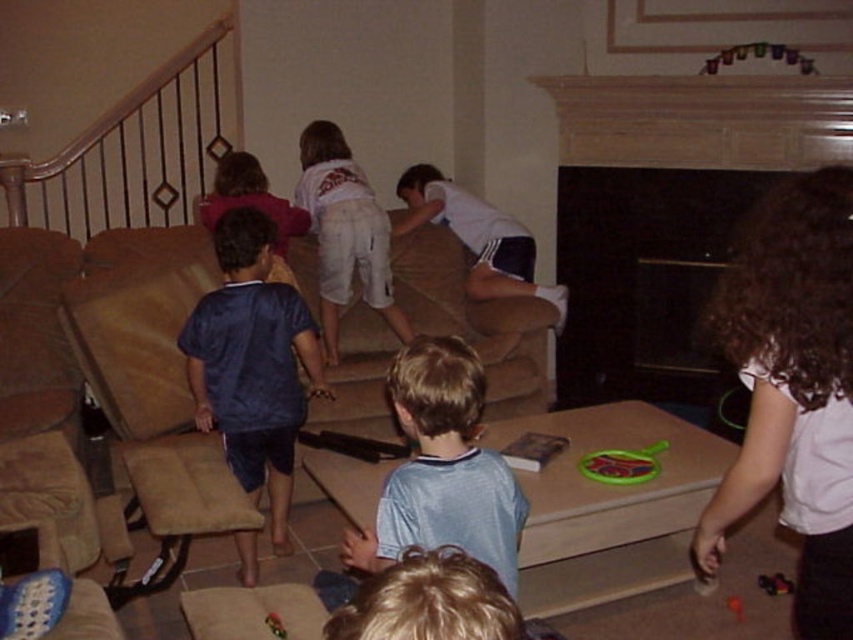
Between black matte fireplace at center and white cotton shorts at center, which one has more height?

black matte fireplace at center is taller.

Who is higher up, black matte fireplace at center or white cotton shorts at center?

white cotton shorts at center is above.

Is point (689, 344) farther from viewer compared to point (334, 154)?

Yes, point (689, 344) is farther from viewer.

Find the location of a particular element. The width and height of the screenshot is (853, 640). black matte fireplace at center is located at coordinates (643, 280).

This screenshot has height=640, width=853. In order to click on black matte fireplace at center in this screenshot , I will do `click(643, 280)`.

Image resolution: width=853 pixels, height=640 pixels. Describe the element at coordinates (643, 280) in the screenshot. I see `black matte fireplace at center` at that location.

The width and height of the screenshot is (853, 640). I want to click on black matte fireplace at center, so click(643, 280).

Which of these two, white cotton shorts at center or rubberized plastic toy at lower right, stands taller?

Standing taller between the two is white cotton shorts at center.

Between white cotton shorts at center and rubberized plastic toy at lower right, which one appears on the left side from the viewer's perspective?

white cotton shorts at center

Is point (329, 163) behind point (772, 580)?

Yes, point (329, 163) is behind point (772, 580).

Locate an element on the screen. This screenshot has height=640, width=853. white cotton shorts at center is located at coordinates [344, 232].